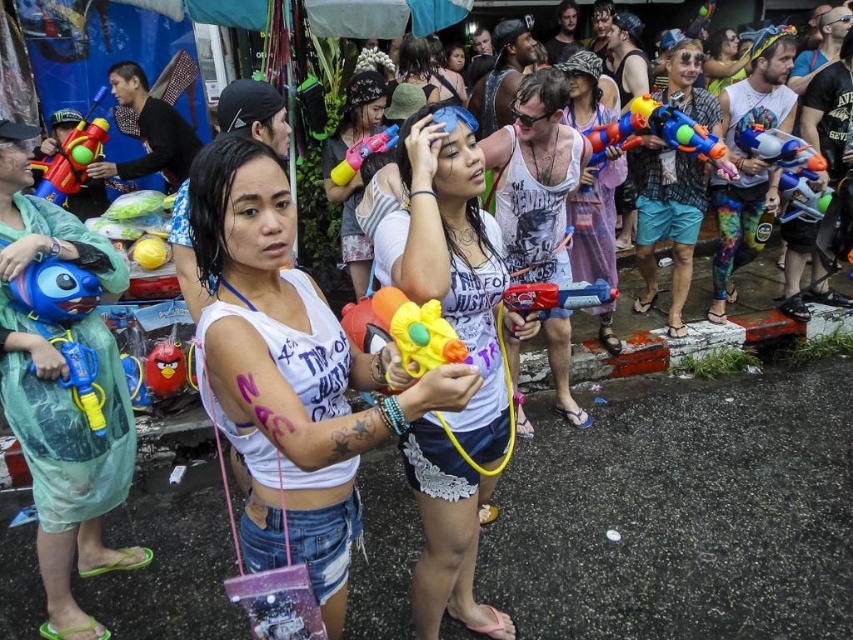
Question: Which of these objects is positioned farthest from the blue plastic water gun at left?

Choices:
 (A) multicolored plastic water gun at upper right
 (B) matte purple dress at center
 (C) white matte tank top at center
 (D) pink rubber water gun at center

Answer: (A)

Question: Is matte yellow water gun at center wider than matte black sunglasses at upper center?

Choices:
 (A) yes
 (B) no

Answer: (A)

Question: Estimate the real-world distances between objects in this image. Which object is farther from the matte plastic angry bird at center?

Choices:
 (A) white matte tank top at center
 (B) pink rubber water gun at center
 (C) matte black sunglasses at upper center

Answer: (C)

Question: Can you confirm if matte purple dress at center is positioned to the right of multicolored plastic water gun at upper right?

Choices:
 (A) no
 (B) yes

Answer: (A)

Question: Among these points, which one is nearest to the camera?

Choices:
 (A) (86, 195)
 (B) (729, 33)
 (C) (465, 145)
 (D) (387, 136)

Answer: (C)

Question: Is yellow matte water gun at center to the right of matte black sunglasses at upper center from the viewer's perspective?

Choices:
 (A) no
 (B) yes

Answer: (A)